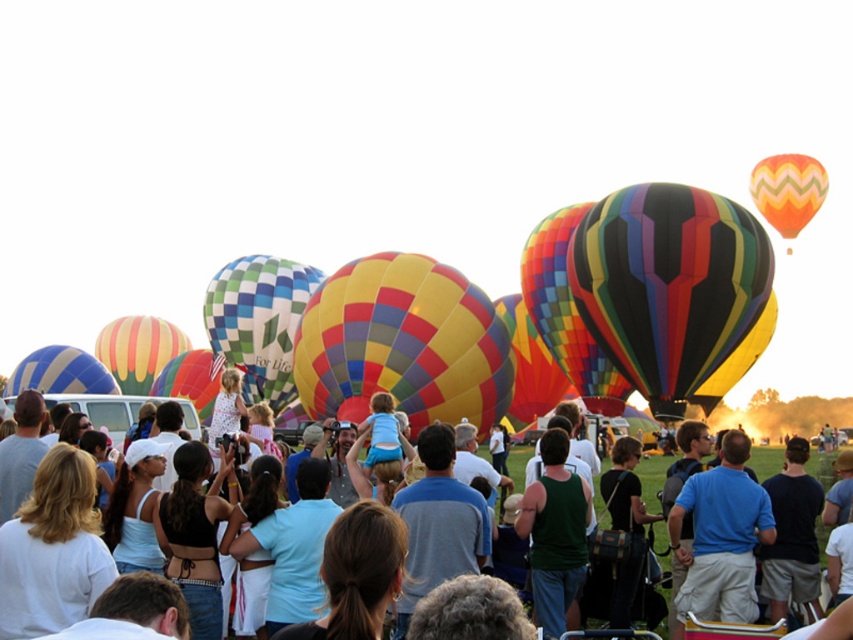
You are a photographer at the hot air balloon festival. You want to capture a photo that includes both the multicolored fabric hot air balloon at center and the yellow and red striped fabric hot air balloon at center. Based on their positions, which balloon should you place on the left side of your photo to ensure both are in frame?

To ensure both the multicolored fabric hot air balloon at center and the yellow and red striped fabric hot air balloon at center are in frame, you should position the yellow and red striped fabric hot air balloon at center on the left side of your photo. This is because the multicolored fabric hot air balloon at center is already on the right side of the yellow and red striped one, so placing the striped one to the left will naturally include both in the shot.

You are a photographer at the hot air balloon festival. You want to capture a photo that includes both the multicolored striped fabric hot air balloon at center and the orange zigzag fabric balloon at upper right. Based on their positions, which balloon should you focus on first to ensure both are in the frame?

The multicolored striped fabric hot air balloon at center is positioned under the orange zigzag fabric balloon at upper right, so you should focus on the orange zigzag fabric balloon at upper right first to ensure both are visible in the frame.